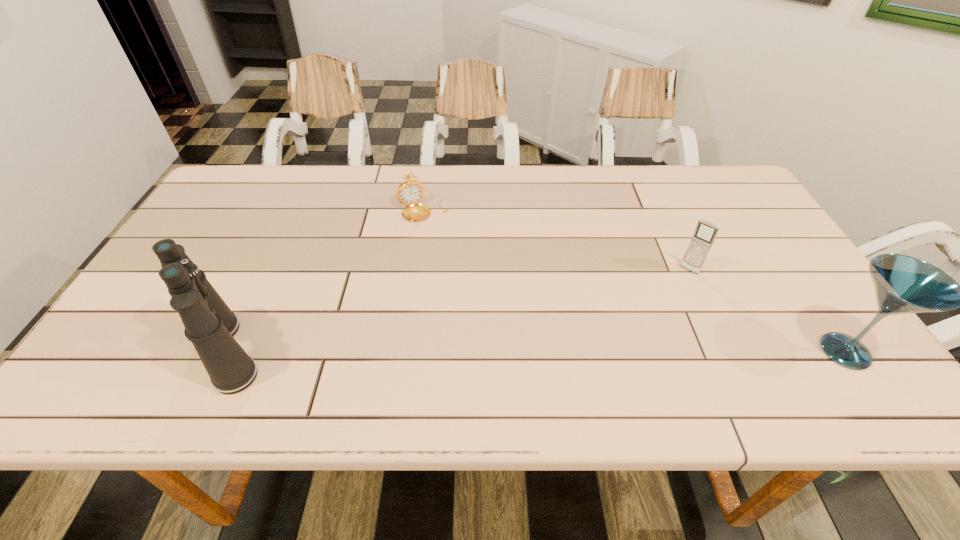
The height and width of the screenshot is (540, 960). I want to click on free space on the desktop that is between the tallest object and the martini and is positioned on the front-facing side of the third object from left to right, so click(x=625, y=352).

At what (x,y) coordinates should I click in order to perform the action: click on free space on the desktop that is between the tallest object and the third shortest object and is positioned on the face of the pocket watch. Please return your answer as a coordinate pair (x, y). Looking at the image, I should click on (512, 352).